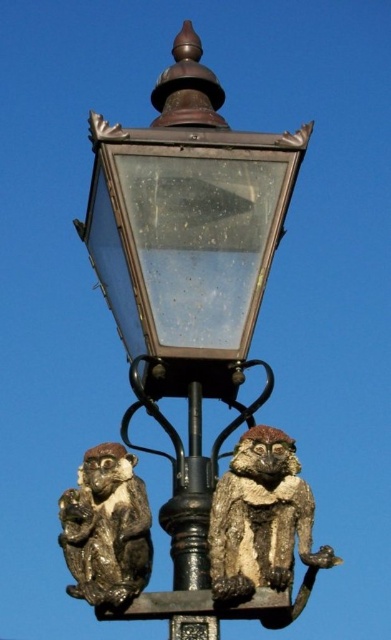
You are a painter standing in front of the vintage street lamp. You need to paint the black metal pole at center but want to avoid getting paint on the bronze textured monkey at lower left. Based on their positions, can you paint the pole without moving the monkey?

The black metal pole at center is behind the bronze textured monkey at lower left, so you can paint the pole without moving the monkey since it is not obstructed by the monkey.

You are a maintenance worker who needs to reach the rusty metal monkey at lower right and the black metal pole at center. Your longest tool is 3 meters. Can you safely reach both objects with your tool?

The rusty metal monkey at lower right is 3.01 meters away from the black metal pole at center. Since your tool is only 3 meters long, it is slightly too short to reach the rusty metal monkey at lower right from the black metal pole at center. You may need a longer tool or an alternative method to access both objects.

You are a painter who needs to decide whether to use a wide brush or a narrow brush to paint the rusty metal monkey at lower right and the black metal pole at center. Based on their widths, which brush should you choose for each object?

The rusty metal monkey at lower right might be wider than the black metal pole at center, so use a wide brush for the rusty metal monkey at lower right and a narrow brush for the black metal pole at center.